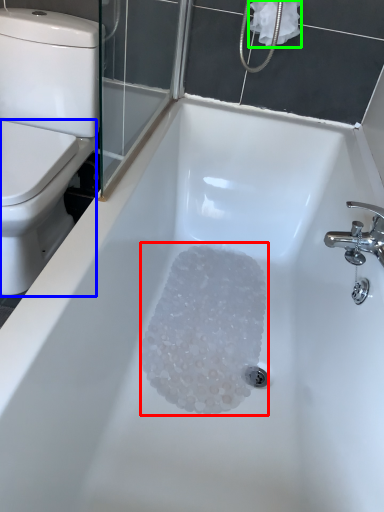
Question: Estimate the real-world distances between objects in this image. Which object is closer to crystal (highlighted by a red box), bidet (highlighted by a blue box) or toilet paper (highlighted by a green box)?

Choices:
 (A) bidet
 (B) toilet paper

Answer: (A)